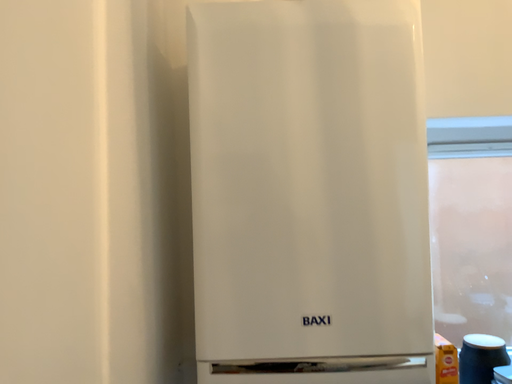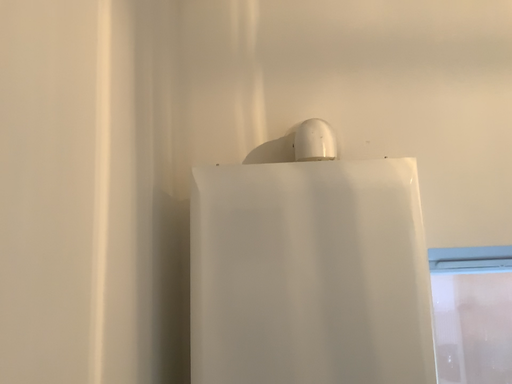
Question: How did the camera likely rotate when shooting the video?

Choices:
 (A) rotated downward
 (B) rotated upward

Answer: (B)